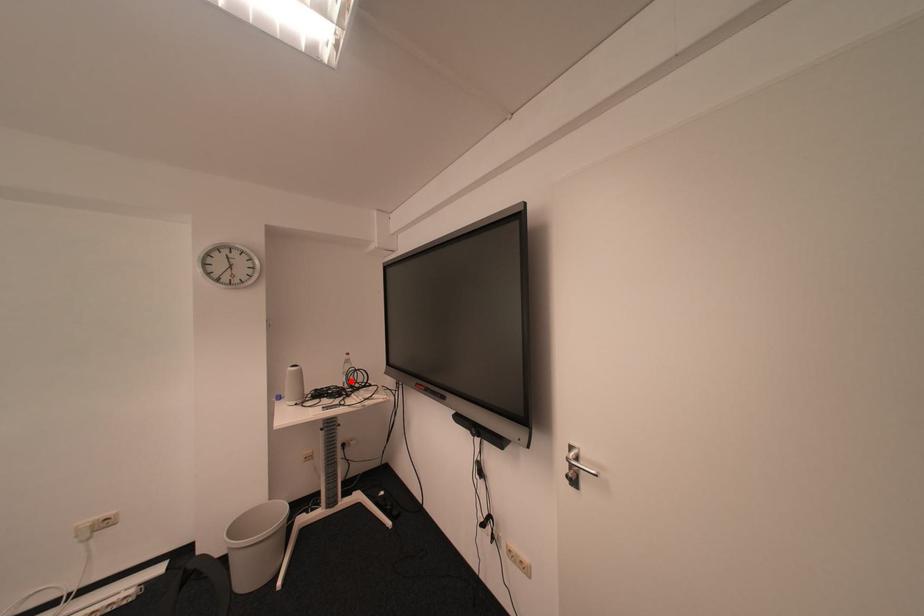
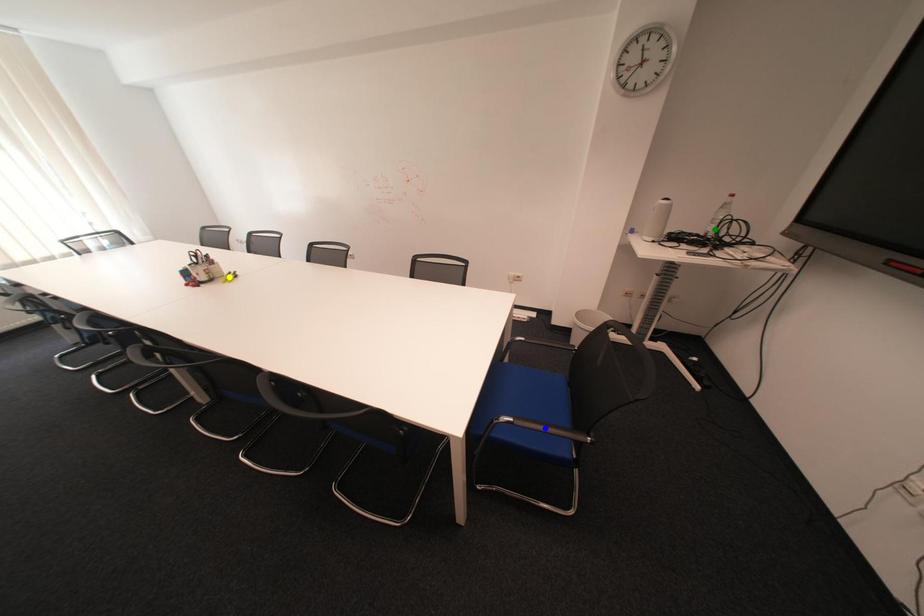
Question: I am providing you with two images of the same scene from different viewpoints. A red point is marked on the first image. You are given multiple points on the second image. Can you choose the point in image 2 that corresponds to the point in image 1?

Choices:
 (A) yellow point
 (B) green point
 (C) blue point

Answer: (B)